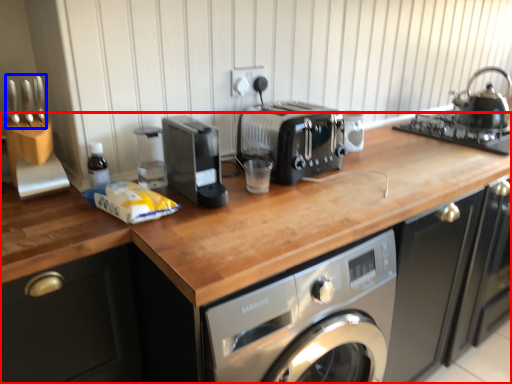
Question: Which object appears closest to the camera in this image, countertop (highlighted by a red box) or cutlery (highlighted by a blue box)?

Choices:
 (A) countertop
 (B) cutlery

Answer: (A)